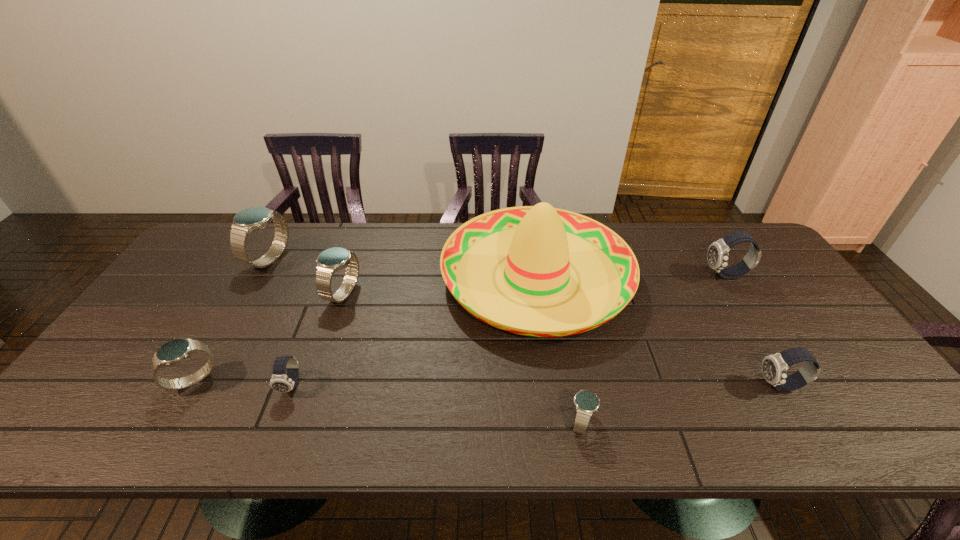
Identify which object is the third closest to the second blue watch from right to left. Please provide its 2D coordinates. Your answer should be formatted as a tuple, i.e. [(x, y)], where the tuple contains the x and y coordinates of a point satisfying the conditions above.

[(541, 243)]

This screenshot has width=960, height=540. I want to click on the third closest watch to the nearest blue watch, so click(x=280, y=382).

Identify which watch is the closest to the second biggest blue watch. Please provide its 2D coordinates. Your answer should be formatted as a tuple, i.e. [(x, y)], where the tuple contains the x and y coordinates of a point satisfying the conditions above.

[(250, 219)]

What are the coordinates of `blue watch object that ranks as the closest to the leftmost dark watch` in the screenshot? It's located at (175, 351).

The height and width of the screenshot is (540, 960). I want to click on blue watch that is the third closest to the biggest blue watch, so click(586, 403).

Identify which dark watch is the third nearest to the third farthest blue watch. Please provide its 2D coordinates. Your answer should be formatted as a tuple, i.e. [(x, y)], where the tuple contains the x and y coordinates of a point satisfying the conditions above.

[(717, 256)]

Image resolution: width=960 pixels, height=540 pixels. I want to click on dark watch that can be found as the closest to the tallest object, so [774, 367].

The height and width of the screenshot is (540, 960). Find the location of `vacant space that satisfies the following two spatial constraints: 1. on the face of the smallest dark watch; 2. on the left side of the third watch from right to left`. vacant space that satisfies the following two spatial constraints: 1. on the face of the smallest dark watch; 2. on the left side of the third watch from right to left is located at coordinates (277, 422).

This screenshot has height=540, width=960. What are the coordinates of `vacant space that satisfies the following two spatial constraints: 1. on the face of the smallest dark watch; 2. on the left side of the smallest blue watch` in the screenshot? It's located at (277, 422).

Identify the location of blank space that satisfies the following two spatial constraints: 1. on the front side of the second smallest blue watch; 2. on the right side of the nearest object. (169, 422).